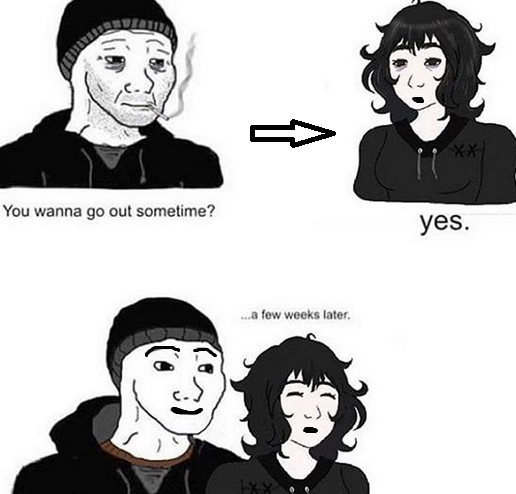
The height and width of the screenshot is (494, 516). What are the coordinates of `hood` in the screenshot? It's located at (68, 418), (55, 121).